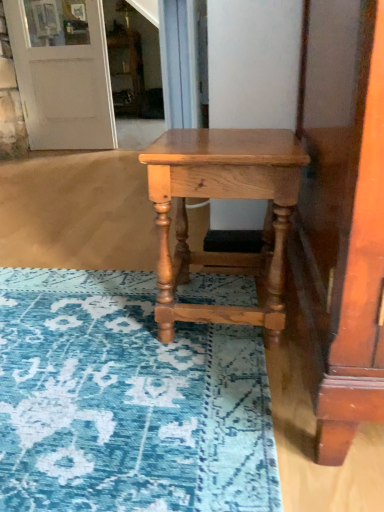
Question: Considering the relative sizes of natural wood table at center and white matte door at upper left in the image provided, is natural wood table at center taller than white matte door at upper left?

Choices:
 (A) yes
 (B) no

Answer: (B)

Question: Is white matte door at upper left located within natural wood table at center?

Choices:
 (A) yes
 (B) no

Answer: (B)

Question: Is natural wood table at center not near white matte door at upper left?

Choices:
 (A) no
 (B) yes

Answer: (B)

Question: From a real-world perspective, does natural wood table at center stand above white matte door at upper left?

Choices:
 (A) no
 (B) yes

Answer: (A)

Question: From the image's perspective, is natural wood table at center above white matte door at upper left?

Choices:
 (A) no
 (B) yes

Answer: (A)

Question: From the image's perspective, would you say natural wood table at center is shown under white matte door at upper left?

Choices:
 (A) yes
 (B) no

Answer: (A)

Question: Is white matte door at upper left positioned with its back to natural wood table at center?

Choices:
 (A) yes
 (B) no

Answer: (B)

Question: From the image's perspective, does white matte door at upper left appear lower than natural wood table at center?

Choices:
 (A) yes
 (B) no

Answer: (B)

Question: Considering the relative sizes of white matte door at upper left and natural wood table at center in the image provided, is white matte door at upper left thinner than natural wood table at center?

Choices:
 (A) yes
 (B) no

Answer: (A)

Question: Considering the relative sizes of white matte door at upper left and natural wood table at center in the image provided, is white matte door at upper left wider than natural wood table at center?

Choices:
 (A) no
 (B) yes

Answer: (A)

Question: Is white matte door at upper left not within natural wood table at center?

Choices:
 (A) yes
 (B) no

Answer: (A)

Question: Is white matte door at upper left to the left of natural wood table at center from the viewer's perspective?

Choices:
 (A) no
 (B) yes

Answer: (B)

Question: Considering the positions of natural wood table at center and white matte door at upper left in the image, is natural wood table at center taller or shorter than white matte door at upper left?

Choices:
 (A) short
 (B) tall

Answer: (A)